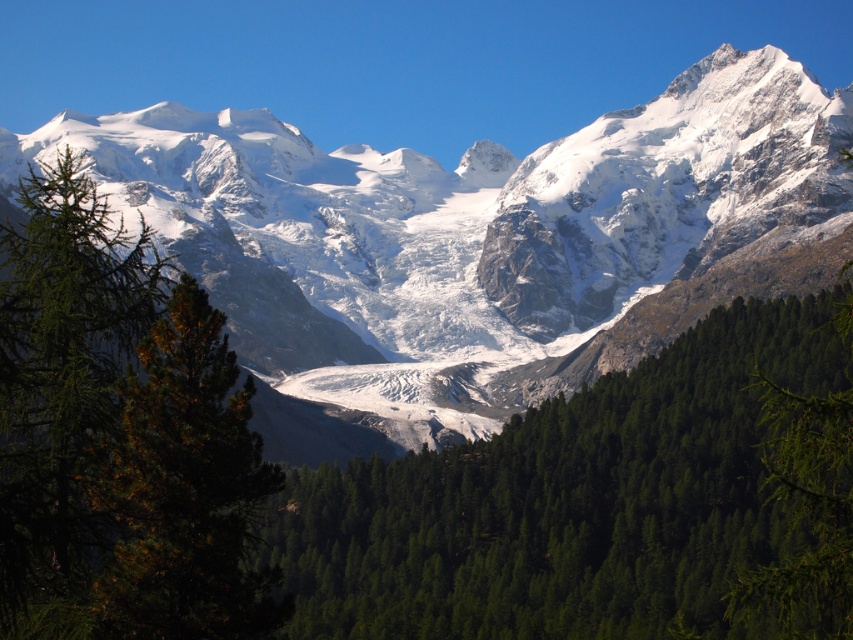
Question: Can you confirm if green matte tree at center is positioned above green matte tree at right?

Choices:
 (A) yes
 (B) no

Answer: (B)

Question: Which object is positioned farthest from the green matte tree at center?

Choices:
 (A) white snow-covered mountain range at center
 (B) green matte tree at right

Answer: (A)

Question: Considering the real-world distances, which object is closest to the green matte tree at right?

Choices:
 (A) green matte tree at center
 (B) green needle-like tree at center-left
 (C) white snow-covered mountain range at center

Answer: (A)

Question: Which object appears farthest from the camera in this image?

Choices:
 (A) green matte tree at center
 (B) green needle-like tree at center-left
 (C) green matte tree at right

Answer: (A)

Question: In this image, where is white snow-covered mountain range at center located relative to green matte tree at center?

Choices:
 (A) right
 (B) left

Answer: (B)

Question: Is white snow-covered mountain range at center wider than green needle-like tree at center-left?

Choices:
 (A) no
 (B) yes

Answer: (B)